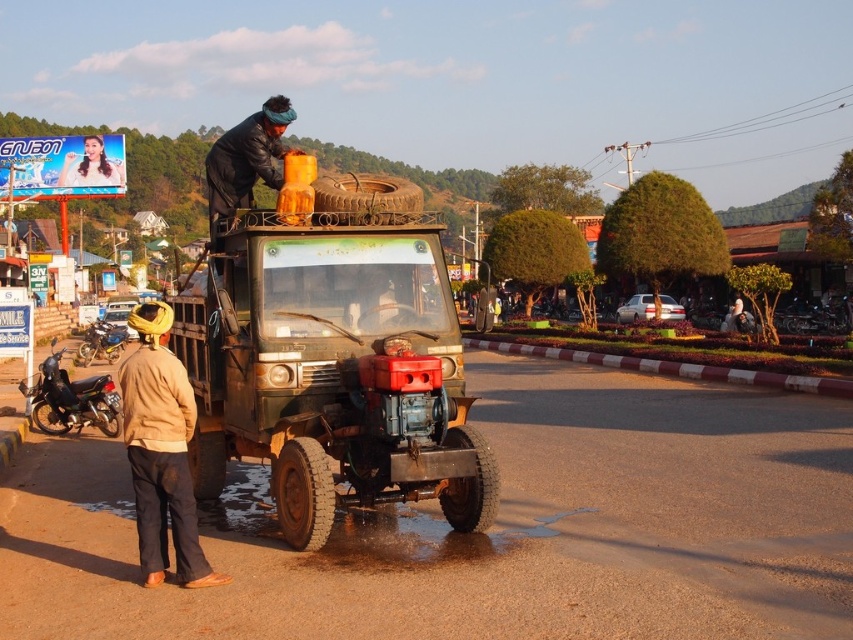
Question: Which object is closer to the camera taking this photo?

Choices:
 (A) black glossy motorcycle at lower left
 (B) brushed metal motorcycle at left
 (C) rusty metal truck at center
 (D) brown cotton jacket at lower left

Answer: (D)

Question: Which of these objects is positioned farthest from the black glossy motorcycle at lower left?

Choices:
 (A) rusty metal truck at center
 (B) brushed metal motorcycle at left
 (C) brown cotton jacket at lower left

Answer: (B)

Question: From the image, what is the correct spatial relationship of black glossy motorcycle at lower left in relation to brushed metal motorcycle at left?

Choices:
 (A) above
 (B) below

Answer: (B)

Question: Which object is the farthest from the brown cotton jacket at lower left?

Choices:
 (A) rusty metal truck at center
 (B) black glossy motorcycle at lower left
 (C) brushed metal motorcycle at left
 (D) black leather jacket at upper center

Answer: (C)

Question: Does brown cotton jacket at lower left appear on the left side of brushed metal motorcycle at left?

Choices:
 (A) no
 (B) yes

Answer: (A)

Question: In this image, where is rusty metal truck at center located relative to brushed metal motorcycle at left?

Choices:
 (A) left
 (B) right

Answer: (B)